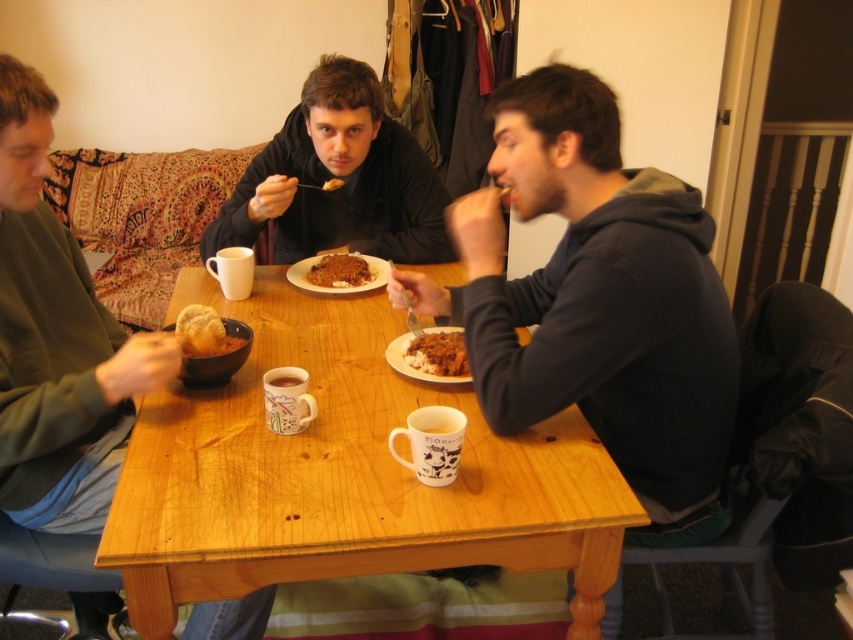
Question: Which point appears farthest from the camera in this image?

Choices:
 (A) (309, 99)
 (B) (331, 184)
 (C) (560, 442)
 (D) (276, 385)

Answer: (B)

Question: Observing the image, what is the correct spatial positioning of brown matte rice at center in reference to white glossy mug at table center?

Choices:
 (A) above
 (B) below

Answer: (A)

Question: Which point is farther from the camera taking this photo?

Choices:
 (A) (207, 339)
 (B) (216, 358)
 (C) (340, 225)
 (D) (426, 339)

Answer: (C)

Question: Does wooden table at center appear under white glossy mug at table center?

Choices:
 (A) yes
 (B) no

Answer: (A)

Question: Does matte brown bowl at center appear under brown matte rice at center?

Choices:
 (A) yes
 (B) no

Answer: (B)

Question: Which of the following is the farthest from the observer?

Choices:
 (A) (329, 145)
 (B) (328, 188)

Answer: (B)